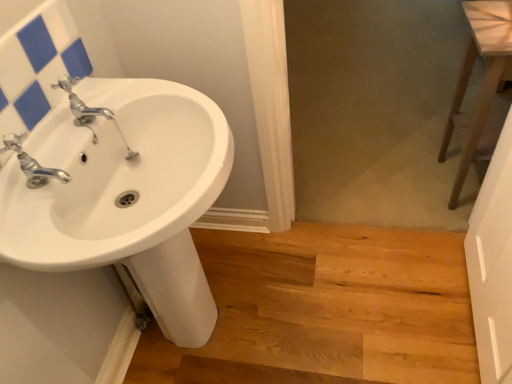
Identify the location of blank area beneath transparent glass screen door at right (from a real-world perspective). (461, 316).